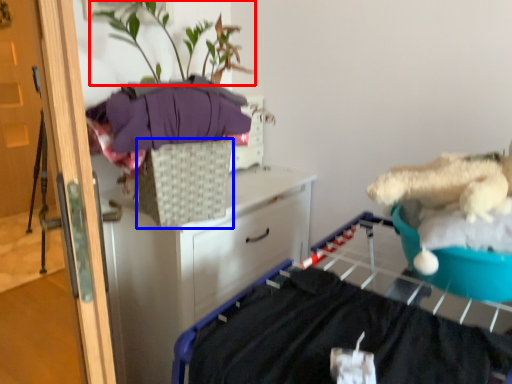
Question: Which point is closer to the camera, plant (highlighted by a red box) or basket (highlighted by a blue box)?

Choices:
 (A) plant
 (B) basket

Answer: (A)